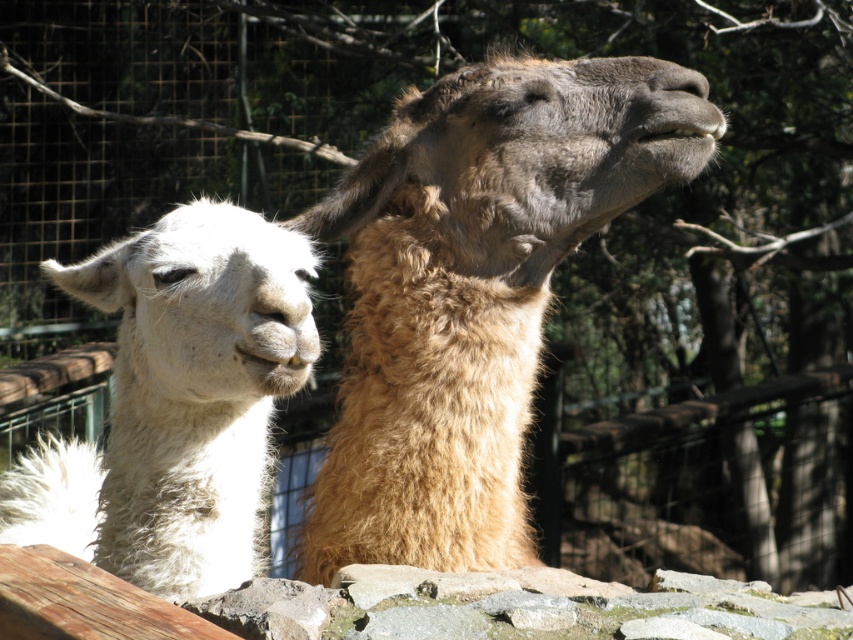
Who is higher up, fuzzy brown alpaca at upper center or white fluffy alpaca at left?

Positioned higher is fuzzy brown alpaca at upper center.

Who is more distant from viewer, (360, 289) or (57, 504)?

Point (57, 504)

Identify the location of fuzzy brown alpaca at upper center. The width and height of the screenshot is (853, 640). (474, 291).